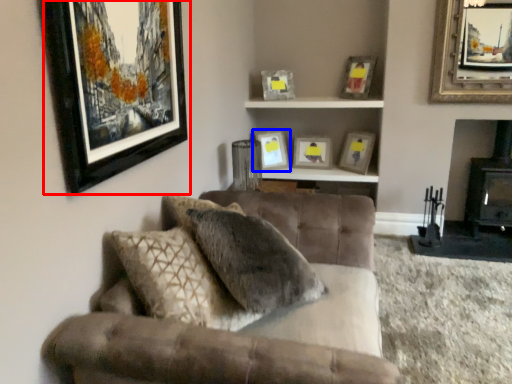
Question: Which object is closer to the camera taking this photo, picture frame (highlighted by a red box) or picture frame (highlighted by a blue box)?

Choices:
 (A) picture frame
 (B) picture frame

Answer: (A)